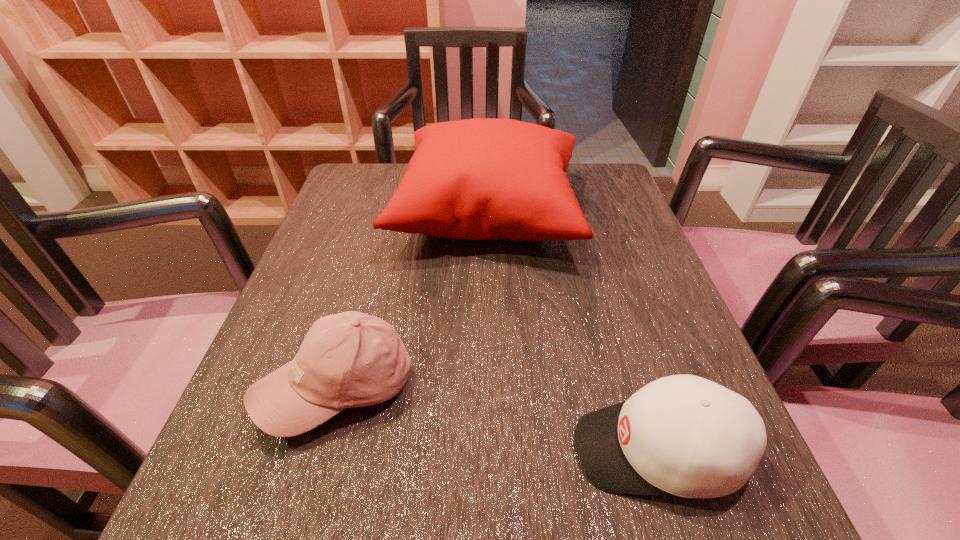
In the image, there is a desktop. At what (x,y) coordinates should I click in order to perform the action: click on free space at the right edge. Please return your answer as a coordinate pair (x, y). Looking at the image, I should click on (626, 362).

Identify the location of vacant space at the far left corner of the desktop. (348, 194).

Find the location of a particular element. vacant area between the left baseball cap and the right baseball cap is located at coordinates (498, 419).

Identify the location of free point between the right baseball cap and the left baseball cap. (498, 419).

This screenshot has height=540, width=960. I want to click on vacant space in between the left baseball cap and the right baseball cap, so click(498, 419).

I want to click on empty space that is in between the left baseball cap and the farthest object, so click(413, 300).

The width and height of the screenshot is (960, 540). I want to click on empty space that is in between the right baseball cap and the left baseball cap, so click(498, 419).

Locate an element on the screen. This screenshot has height=540, width=960. blank region between the right baseball cap and the tallest object is located at coordinates (573, 330).

Identify the location of vacant point located between the right baseball cap and the farthest object. This screenshot has width=960, height=540. (573, 330).

Find the location of a particular element. The height and width of the screenshot is (540, 960). empty space that is in between the left baseball cap and the right baseball cap is located at coordinates (498, 419).